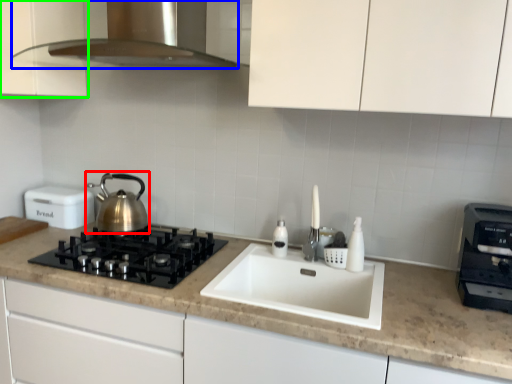
Question: Estimate the real-world distances between objects in this image. Which object is farther from kettle (highlighted by a red box), home appliance (highlighted by a blue box) or cabinetry (highlighted by a green box)?

Choices:
 (A) home appliance
 (B) cabinetry

Answer: (A)